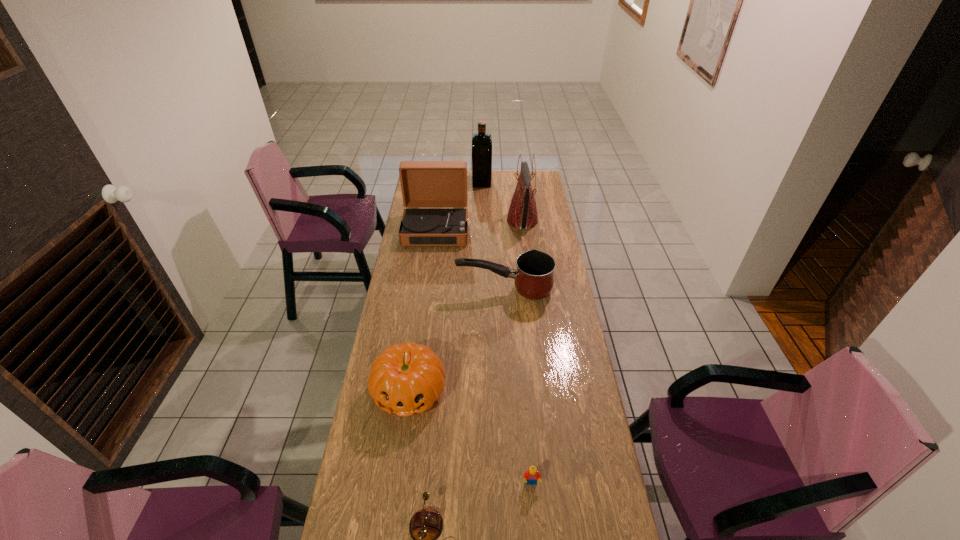
Locate an element on the screen. The image size is (960, 540). saucepan located at the right edge is located at coordinates (534, 278).

Locate an element on the screen. This screenshot has width=960, height=540. vacant space at the left edge of the desktop is located at coordinates (387, 417).

In the image, there is a desktop. At what (x,y) coordinates should I click in order to perform the action: click on free space at the right edge. Please return your answer as a coordinate pair (x, y). The image size is (960, 540). Looking at the image, I should click on (547, 362).

Identify the location of vacant area at the far right corner of the desktop. (535, 178).

This screenshot has height=540, width=960. Identify the location of vacant region between the liquor and the handbag. (502, 201).

The height and width of the screenshot is (540, 960). I want to click on free area in between the handbag and the fifth farthest object, so click(x=466, y=306).

This screenshot has height=540, width=960. Identify the location of free space between the saucepan and the second nearest object. [x=517, y=386].

Locate an element on the screen. The width and height of the screenshot is (960, 540). vacant area between the handbag and the phonograph record is located at coordinates [x=479, y=225].

The width and height of the screenshot is (960, 540). In order to click on vacant space that is in between the handbag and the pumpkin in this screenshot , I will do `click(466, 306)`.

The image size is (960, 540). I want to click on vacant area between the pumpkin and the Lego, so click(470, 437).